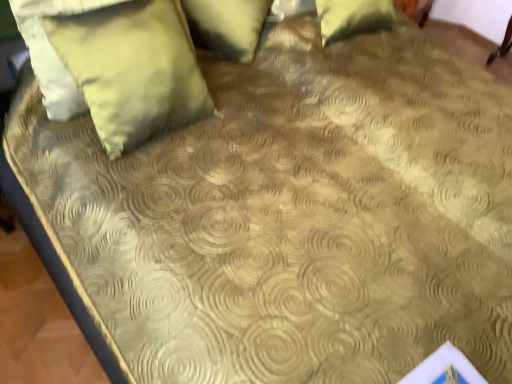
Question: Is green fabric pillow at upper center, the 1th pillow positioned from the top, located outside satin yellow pillow at upper left, which is the second pillow in top-to-bottom order?

Choices:
 (A) no
 (B) yes

Answer: (B)

Question: Is green fabric pillow at upper center, the 2th pillow positioned from the bottom, taller than satin yellow pillow at upper left, which is the second pillow in top-to-bottom order?

Choices:
 (A) no
 (B) yes

Answer: (A)

Question: Can you confirm if green fabric pillow at upper center, the 1th pillow positioned from the top, is bigger than satin yellow pillow at upper left, which is counted as the 1th pillow, starting from the bottom?

Choices:
 (A) no
 (B) yes

Answer: (B)

Question: Does green fabric pillow at upper center, the 2th pillow positioned from the bottom, appear on the left side of satin yellow pillow at upper left, which is counted as the 1th pillow, starting from the bottom?

Choices:
 (A) yes
 (B) no

Answer: (B)

Question: Can you confirm if green fabric pillow at upper center, the 2th pillow positioned from the bottom, is thinner than satin yellow pillow at upper left, which is counted as the 1th pillow, starting from the bottom?

Choices:
 (A) no
 (B) yes

Answer: (A)

Question: Is green fabric pillow at upper center, the 1th pillow positioned from the top, closer to camera compared to satin yellow pillow at upper left, which is counted as the 1th pillow, starting from the bottom?

Choices:
 (A) no
 (B) yes

Answer: (A)

Question: From the image's perspective, is satin yellow pillow at upper left, which is the second pillow in top-to-bottom order, on green fabric pillow at upper center, the 2th pillow positioned from the bottom?

Choices:
 (A) yes
 (B) no

Answer: (B)

Question: Is satin yellow pillow at upper left, which is the second pillow in top-to-bottom order, bigger than green fabric pillow at upper center, the 1th pillow positioned from the top?

Choices:
 (A) yes
 (B) no

Answer: (B)

Question: Is satin yellow pillow at upper left, which is the second pillow in top-to-bottom order, touching green fabric pillow at upper center, the 2th pillow positioned from the bottom?

Choices:
 (A) yes
 (B) no

Answer: (B)

Question: From a real-world perspective, is satin yellow pillow at upper left, which is the second pillow in top-to-bottom order, beneath green fabric pillow at upper center, the 2th pillow positioned from the bottom?

Choices:
 (A) no
 (B) yes

Answer: (A)

Question: Does satin yellow pillow at upper left, which is counted as the 1th pillow, starting from the bottom, have a lesser width compared to green fabric pillow at upper center, the 2th pillow positioned from the bottom?

Choices:
 (A) yes
 (B) no

Answer: (A)

Question: Is satin yellow pillow at upper left, which is the second pillow in top-to-bottom order, to the left of green fabric pillow at upper center, the 1th pillow positioned from the top, from the viewer's perspective?

Choices:
 (A) no
 (B) yes

Answer: (B)

Question: From a real-world perspective, relative to green fabric pillow at upper center, the 1th pillow positioned from the top, is satin yellow pillow at upper left, which is counted as the 1th pillow, starting from the bottom, vertically above or below?

Choices:
 (A) below
 (B) above

Answer: (B)